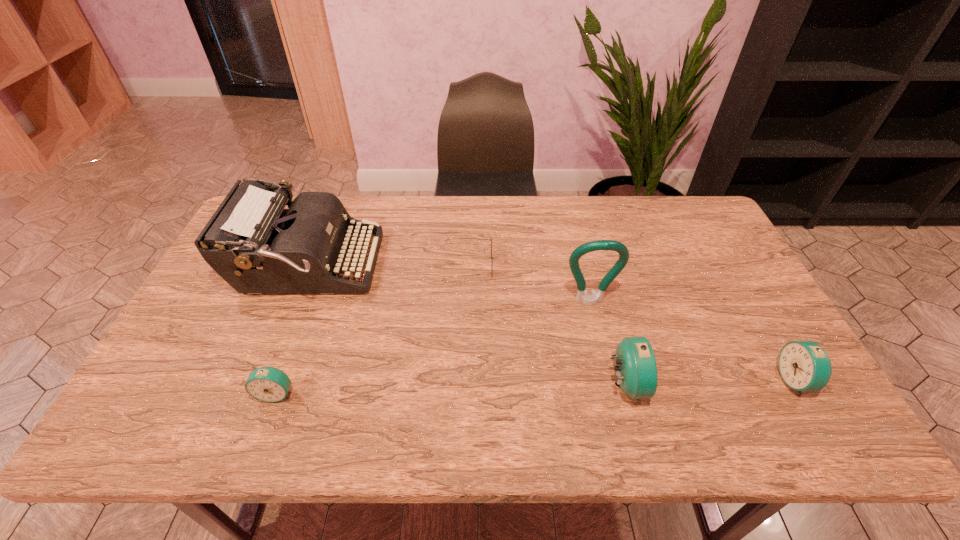
Where is `object that is at the far left corner`? This screenshot has width=960, height=540. object that is at the far left corner is located at coordinates (252, 242).

At what (x,y) coordinates should I click in order to perform the action: click on object located in the near right corner section of the desktop. Please return your answer as a coordinate pair (x, y). This screenshot has height=540, width=960. Looking at the image, I should click on (804, 365).

At what (x,y) coordinates should I click in order to perform the action: click on free spot at the far edge of the desktop. Please return your answer as a coordinate pair (x, y). This screenshot has width=960, height=540. Looking at the image, I should click on (490, 200).

I want to click on blank space at the near edge of the desktop, so click(293, 380).

This screenshot has height=540, width=960. In the image, there is a desktop. Find the location of `blank space at the left edge`. blank space at the left edge is located at coordinates (229, 333).

Locate an element on the screen. The width and height of the screenshot is (960, 540). vacant region at the right edge of the desktop is located at coordinates (767, 354).

Where is `vacant space at the near left corner of the desktop`? This screenshot has height=540, width=960. vacant space at the near left corner of the desktop is located at coordinates click(x=204, y=382).

Identify the location of vacant space at the near right corner of the desktop. (802, 396).

At what (x,y) coordinates should I click in order to perform the action: click on unoccupied area between the third shortest object and the bottle opener. Please return your answer as a coordinate pair (x, y). Looking at the image, I should click on (692, 341).

The image size is (960, 540). In order to click on free point between the leftmost alarm clock and the typewriter in this screenshot , I will do `click(292, 329)`.